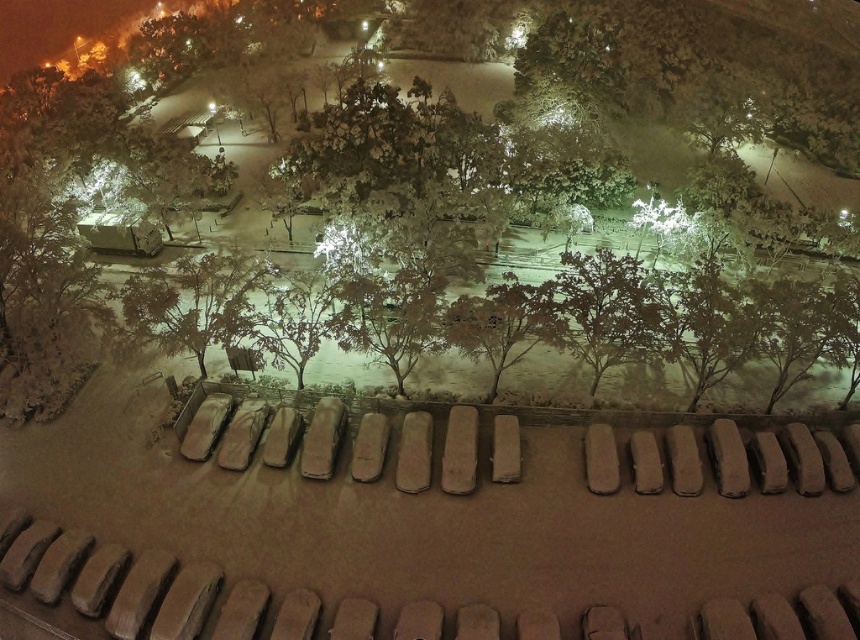
Is green matte tree at center thinner than snowy bark tree at center?

Incorrect, green matte tree at center's width is not less than snowy bark tree at center's.

Which is more to the left, green matte tree at center or snowy bark tree at center?

From the viewer's perspective, green matte tree at center appears more on the left side.

The width and height of the screenshot is (860, 640). I want to click on green matte tree at center, so click(189, 301).